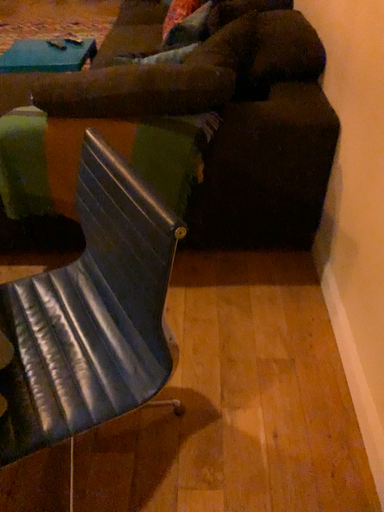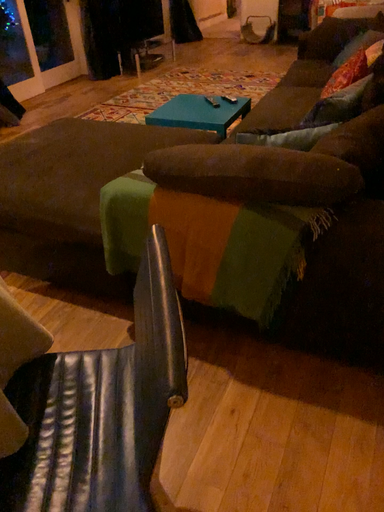
Question: Which way did the camera rotate in the video?

Choices:
 (A) rotated downward
 (B) rotated upward

Answer: (B)